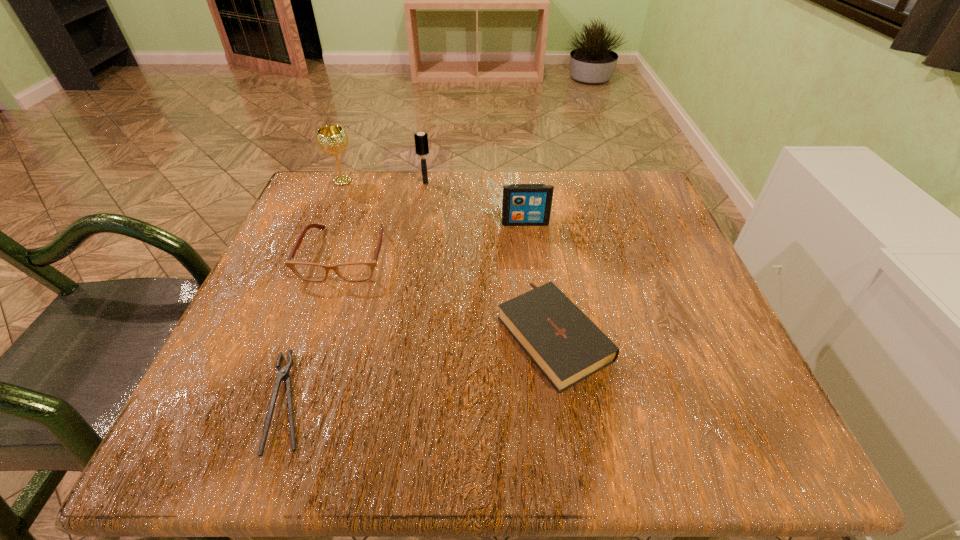
The width and height of the screenshot is (960, 540). Identify the location of chalice. (331, 139).

At what (x,y) coordinates should I click in order to perform the action: click on the fourth object from left to right. Please return your answer as a coordinate pair (x, y). Looking at the image, I should click on (421, 142).

Locate an element on the screen. This screenshot has width=960, height=540. the fourth nearest object is located at coordinates (523, 204).

You are a GUI agent. You are given a task and a screenshot of the screen. Output one action in this format:
    pyautogui.click(x=<x>, y=<y>)
    Task: Click on the third tallest object
    
    Given the screenshot: What is the action you would take?
    pyautogui.click(x=523, y=204)

You are a GUI agent. You are given a task and a screenshot of the screen. Output one action in this format:
    pyautogui.click(x=<x>, y=<y>)
    Task: Click on the fourth tallest object
    The image size is (960, 540).
    Given the screenshot: What is the action you would take?
    pyautogui.click(x=354, y=271)

Locate an element on the screen. The image size is (960, 540). the fifth tallest object is located at coordinates (567, 347).

Identify the location of tongs. The image size is (960, 540). (283, 374).

You are a GUI agent. You are given a task and a screenshot of the screen. Output one action in this format:
    pyautogui.click(x=<x>, y=<y>)
    Task: Click on the free space located on the front of the chalice
    The height and width of the screenshot is (540, 960).
    Given the screenshot: What is the action you would take?
    pyautogui.click(x=327, y=215)

At what (x,y) coordinates should I click in order to perform the action: click on free space located on the front of the third object from right to left. Please return your answer as a coordinate pair (x, y). Looking at the image, I should click on (423, 198).

The image size is (960, 540). Identify the location of vacant point located on the front screen of the iPod. (530, 263).